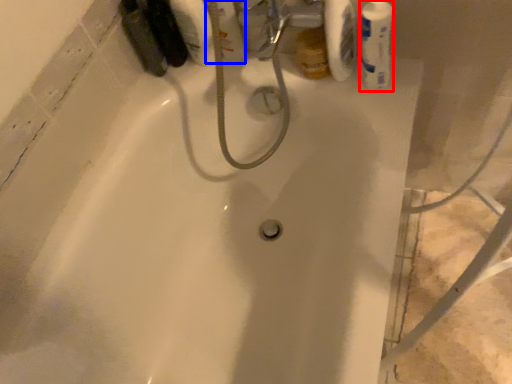
Question: Which of the following is the farthest to the observer, mouthwash (highlighted by a red box) or mouthwash (highlighted by a blue box)?

Choices:
 (A) mouthwash
 (B) mouthwash

Answer: (B)